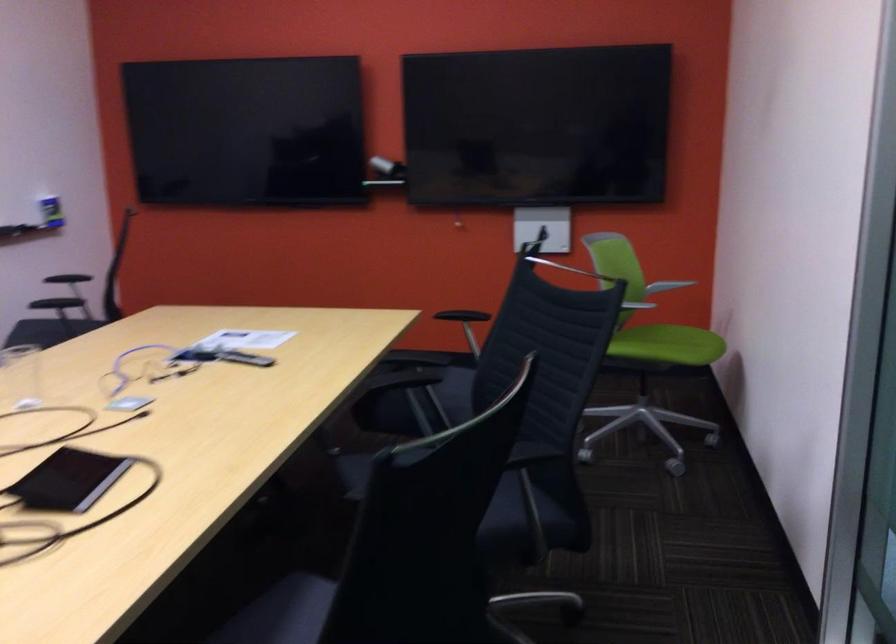
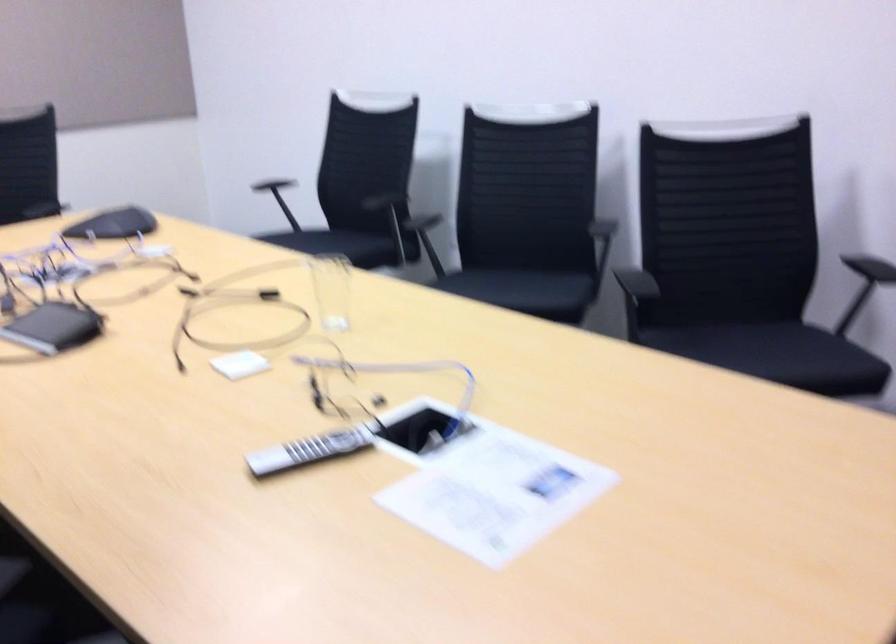
In the second image, find the point that corresponds to pixel 186 368 in the first image.

(419, 430)